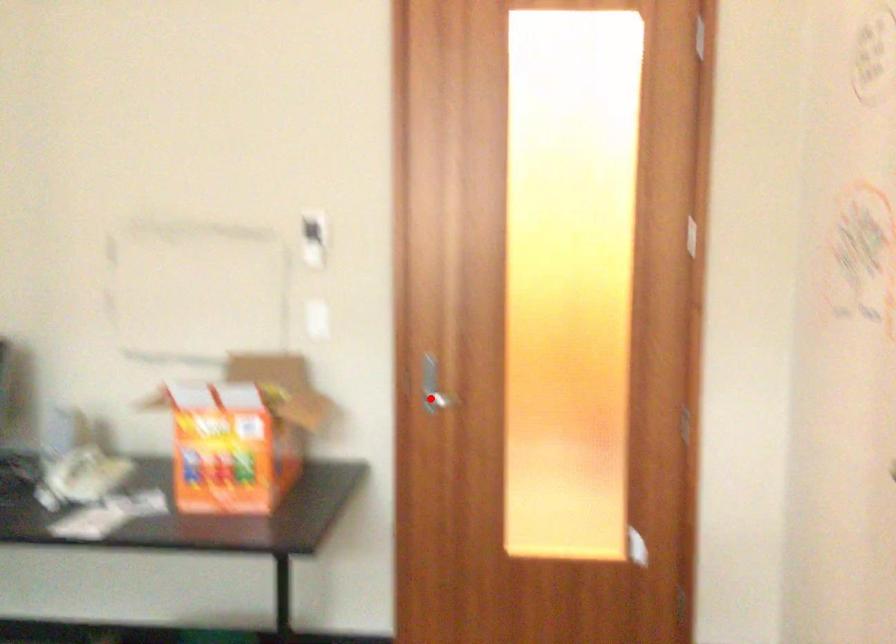
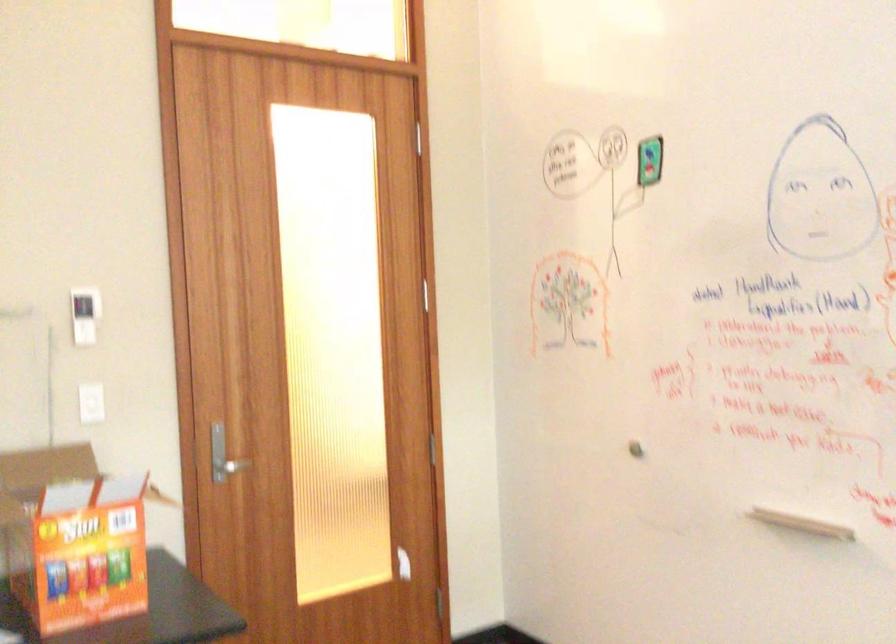
In the second image, find the point that corresponds to the highlighted location in the first image.

(226, 466)